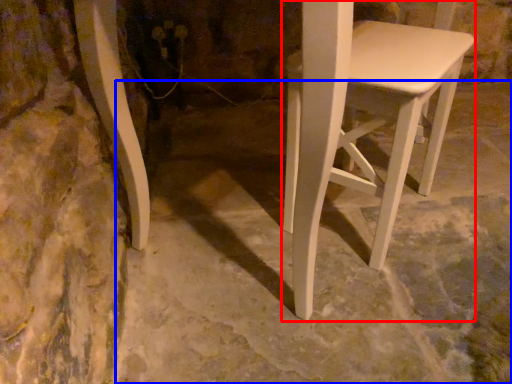
Question: Among these objects, which one is farthest to the camera, stool (highlighted by a red box) or concrete (highlighted by a blue box)?

Choices:
 (A) stool
 (B) concrete

Answer: (A)